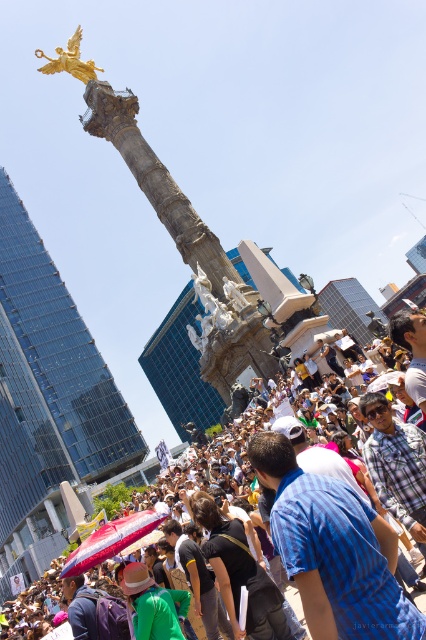
You are a photographer trying to capture the gold polished statue at upper left and the blue plaid shirt at center in the same frame. Based on their positions, which object should you adjust your camera to focus on first to ensure both are in the shot?

You should focus on the gold polished statue at upper left first because the blue plaid shirt at center is to the right of it, so adjusting the frame from the leftward object ensures both are included.

You are a photographer standing in the crowd and want to take a photo of the gold polished statue at upper left without the matte black crowd at center blocking the view. Which direction should you move to achieve this?

The matte black crowd at center is to the right of the gold polished statue at upper left, so moving to the left side of the crowd will position you to the left of the crowd and allow an unobstructed view of the statue.

You are a photographer trying to capture a clear shot of the monument. You notice two groups in the foreground. One is a person wearing a blue plaid shirt at center and the other is a matte black crowd at center. Which group should you move to your right to get them out of the frame?

To get the blue plaid shirt at center out of the frame, you should move to your right since it is positioned to the right of the matte black crowd at center.